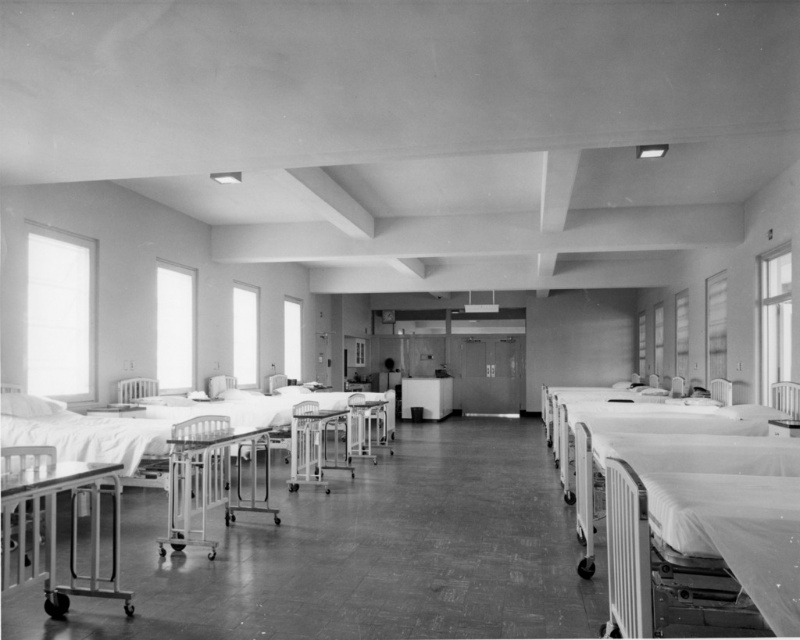
Question: Can you confirm if white smooth bed at right is positioned to the left of metallic hospital bed at lower left?

Choices:
 (A) no
 (B) yes

Answer: (A)

Question: Does white smooth bed at right have a larger size compared to metallic hospital bed at lower left?

Choices:
 (A) no
 (B) yes

Answer: (A)

Question: Is white smooth bed at right in front of metallic hospital bed at lower left?

Choices:
 (A) no
 (B) yes

Answer: (A)

Question: Which of the following is the closest to the observer?

Choices:
 (A) (100, 589)
 (B) (692, 582)

Answer: (B)

Question: Among these points, which one is nearest to the camera?

Choices:
 (A) (748, 548)
 (B) (108, 584)

Answer: (A)

Question: Which point appears closest to the camera in this image?

Choices:
 (A) (646, 557)
 (B) (82, 467)

Answer: (A)